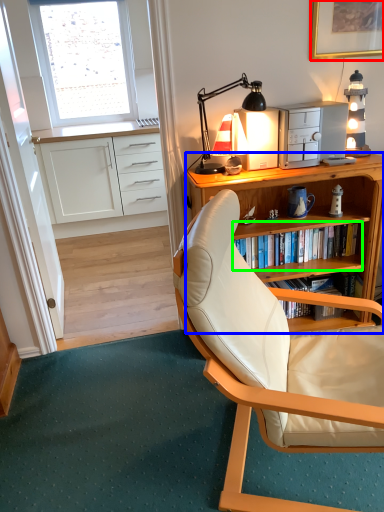
Question: Estimate the real-world distances between objects in this image. Which object is closer to picture frame (highlighted by a red box), desk (highlighted by a blue box) or shelf (highlighted by a green box)?

Choices:
 (A) desk
 (B) shelf

Answer: (A)